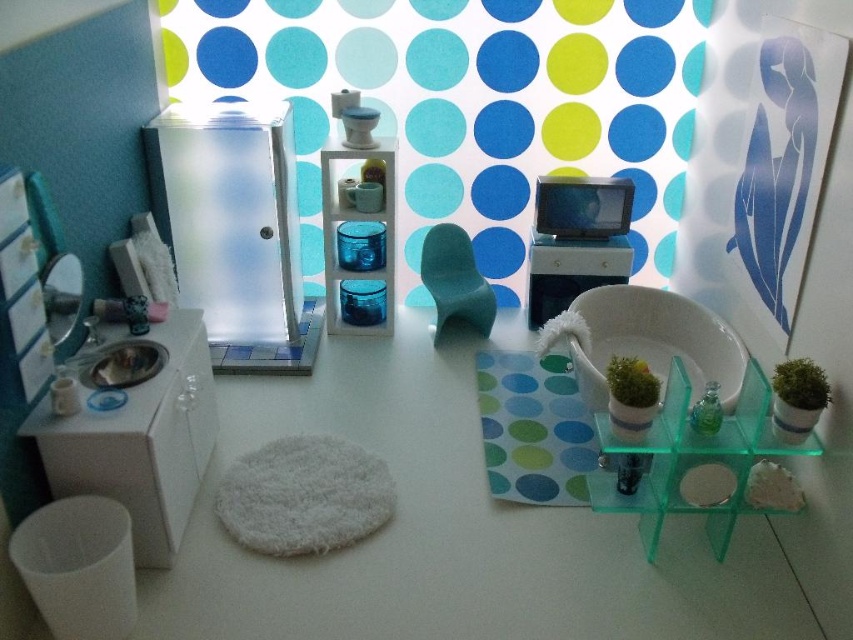
Question: Is translucent green glass shelf at center right behind spongy rubber at center?

Choices:
 (A) yes
 (B) no

Answer: (B)

Question: Can you confirm if frosted glass cabinet at upper left is wider than green moss at center?

Choices:
 (A) no
 (B) yes

Answer: (B)

Question: Is translucent green glass shelf at center right wider than green mossy plant at right?

Choices:
 (A) yes
 (B) no

Answer: (A)

Question: Based on their relative distances, which object is farther from the satin white vanity at center?

Choices:
 (A) frosted glass cabinet at upper left
 (B) green moss at center
 (C) green mossy plant at right

Answer: (B)

Question: Which point appears farthest from the camera in this image?

Choices:
 (A) (779, 365)
 (B) (59, 474)
 (C) (628, 259)
 (D) (656, 388)

Answer: (C)

Question: Considering the real-world distances, which object is closest to the translucent green glass shelf at center right?

Choices:
 (A) spongy rubber at center
 (B) white glossy vanity at left
 (C) green moss at center
 (D) green mossy plant at right

Answer: (C)